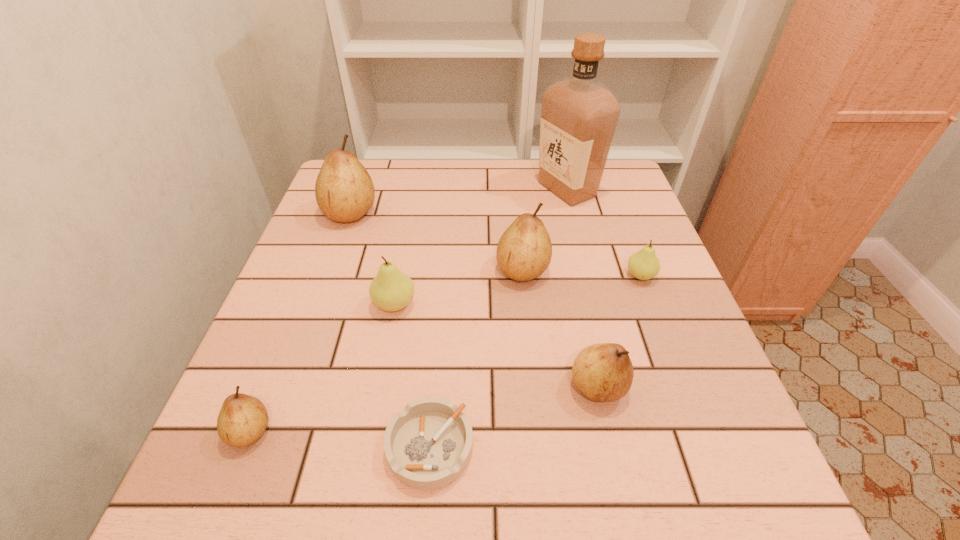
You are a GUI agent. You are given a task and a screenshot of the screen. Output one action in this format:
    pyautogui.click(x=<x>, y=<y>)
    Task: Click on the farther green pear
    The width and height of the screenshot is (960, 540).
    Given the screenshot: What is the action you would take?
    pyautogui.click(x=644, y=265)

What are the coordinates of `the rightmost pear` in the screenshot? It's located at click(644, 265).

I want to click on the smallest brown pear, so click(x=242, y=420).

The width and height of the screenshot is (960, 540). What are the coordinates of `the shortest object` in the screenshot? It's located at (428, 445).

This screenshot has height=540, width=960. Find the location of `free space located on the front-facing side of the tallest object`. free space located on the front-facing side of the tallest object is located at coordinates (430, 190).

This screenshot has height=540, width=960. Find the location of `free space located 0.400m on the front-facing side of the tallest object`. free space located 0.400m on the front-facing side of the tallest object is located at coordinates (390, 190).

Locate an element on the screen. This screenshot has width=960, height=540. vacant space located on the front-facing side of the tallest object is located at coordinates pos(390,190).

Where is `free location located 0.290m on the front of the second tallest object`? Image resolution: width=960 pixels, height=540 pixels. free location located 0.290m on the front of the second tallest object is located at coordinates (312, 320).

Locate an element on the screen. free location located 0.380m on the back of the third brown pear from left to right is located at coordinates (512, 168).

This screenshot has height=540, width=960. In order to click on vacant area situated on the right of the nearer green pear in this screenshot , I will do `click(489, 305)`.